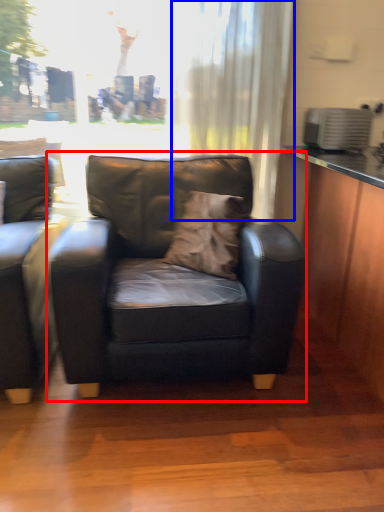
Question: Which point is closer to the camera, chair (highlighted by a red box) or curtain (highlighted by a blue box)?

Choices:
 (A) chair
 (B) curtain

Answer: (A)